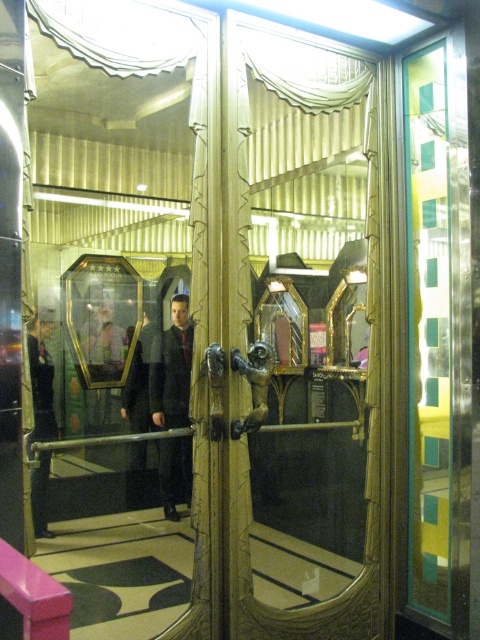
You are standing in front of the double doors and see the dark gray fabric jacket at center. If you want to reach the jacket, in which direction should you move relative to your current position?

The dark gray fabric jacket at center is located at point 0.577 on the x axis and 0.358 on the y axis, so you should move forward and slightly to the right to reach it.

You are a security guard in a museum and need to determine if the dark gray fabric jacket at center and the black fabric uniform at left can fit side by side on a bench that is 1.2 meters wide. What should you consider?

The dark gray fabric jacket at center is narrower than the black fabric uniform at left. To determine if they can fit side by side, you need to know the combined width of both items. If their total width is less than or equal to 1.2 meters, they can fit.

You are a security guard wearing a black fabric uniform at left and you need to exit through the gold textured glass door at center. Which direction should you move to reach the door?

The gold textured glass door at center is to the right of the black fabric uniform at left, so the security guard should move to the right to reach the door.